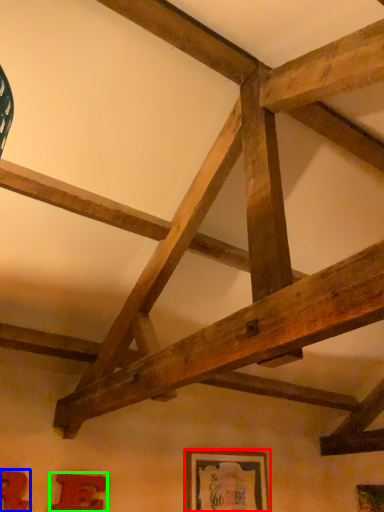
Question: Based on their relative distances, which object is nearer to picture frame (highlighted by a red box)? Choose from picture frame (highlighted by a blue box) and picture frame (highlighted by a green box).

Choices:
 (A) picture frame
 (B) picture frame

Answer: (B)